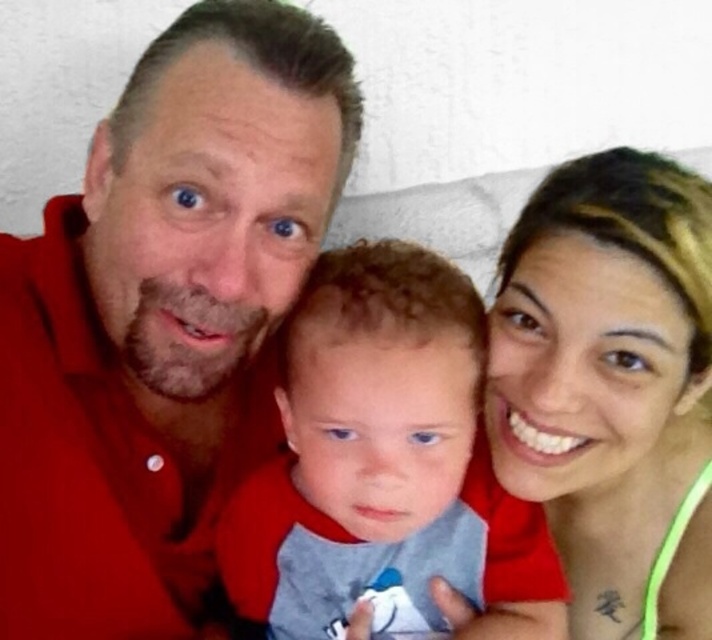
Is smooth skin face at upper right to the right of soft cotton shirt at center from the viewer's perspective?

Yes, smooth skin face at upper right is to the right of soft cotton shirt at center.

Which is behind, point (580, 438) or point (303, 308)?

Positioned behind is point (580, 438).

The width and height of the screenshot is (712, 640). Describe the element at coordinates (604, 368) in the screenshot. I see `smooth skin face at upper right` at that location.

Locate an element on the screen. The height and width of the screenshot is (640, 712). smooth skin face at upper right is located at coordinates (604, 368).

Does point (11, 252) come closer to viewer compared to point (226, 556)?

Yes, point (11, 252) is in front of point (226, 556).

Is point (224, 220) farther from viewer compared to point (412, 477)?

No, (224, 220) is closer to viewer.

Identify the location of matte red shirt at center. (162, 320).

Is matte red shirt at center closer to camera compared to smooth skin face at upper right?

Yes, it is in front of smooth skin face at upper right.

Which is behind, point (251, 132) or point (674, 328)?

Positioned behind is point (674, 328).

Image resolution: width=712 pixels, height=640 pixels. In order to click on matte red shirt at center in this screenshot , I will do `click(162, 320)`.